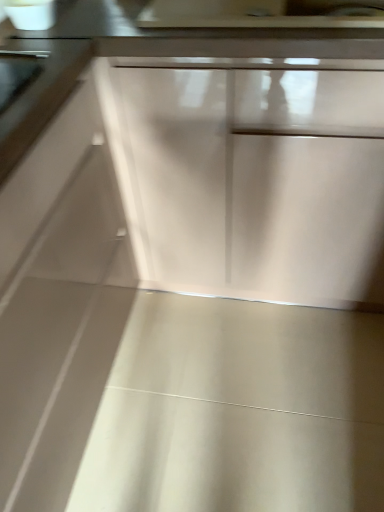
Question: Do you think matte white drawer at center is within satin silver handle at upper left, or outside of it?

Choices:
 (A) inside
 (B) outside

Answer: (B)

Question: From their relative heights in the image, would you say matte white drawer at center is taller or shorter than satin silver handle at upper left?

Choices:
 (A) tall
 (B) short

Answer: (A)

Question: From a real-world perspective, relative to satin silver handle at upper left, is matte white drawer at center vertically above or below?

Choices:
 (A) above
 (B) below

Answer: (B)

Question: Is point (14, 51) closer or farther from the camera than point (193, 76)?

Choices:
 (A) closer
 (B) farther

Answer: (A)

Question: In the image, is satin silver handle at upper left on the left side or the right side of matte white drawer at center?

Choices:
 (A) left
 (B) right

Answer: (A)

Question: Is satin silver handle at upper left wider or thinner than matte white drawer at center?

Choices:
 (A) thin
 (B) wide

Answer: (A)

Question: Considering the positions of satin silver handle at upper left and matte white drawer at center in the image, is satin silver handle at upper left taller or shorter than matte white drawer at center?

Choices:
 (A) short
 (B) tall

Answer: (A)